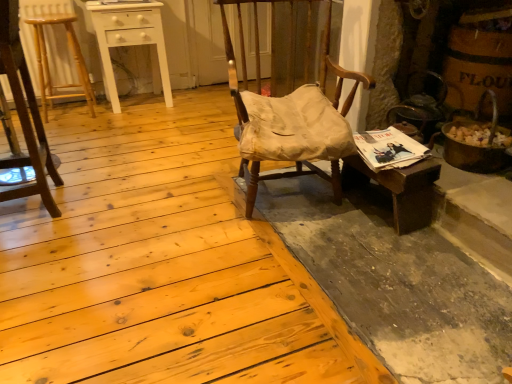
Question: Is wooden stool at left, which is the 2th chair in right-to-left order, shorter than matte paper magazine at right?

Choices:
 (A) yes
 (B) no

Answer: (B)

Question: From the image's perspective, is wooden stool at left, the first chair in the left-to-right sequence, on matte paper magazine at right?

Choices:
 (A) no
 (B) yes

Answer: (B)

Question: From the image's perspective, is wooden stool at left, the first chair in the left-to-right sequence, located beneath matte paper magazine at right?

Choices:
 (A) yes
 (B) no

Answer: (B)

Question: Is wooden stool at left, the first chair in the left-to-right sequence, closer to camera compared to matte paper magazine at right?

Choices:
 (A) no
 (B) yes

Answer: (B)

Question: Is wooden stool at left, the first chair in the left-to-right sequence, positioned with its back to matte paper magazine at right?

Choices:
 (A) no
 (B) yes

Answer: (A)

Question: Are wooden stool at left, the first chair in the left-to-right sequence, and matte paper magazine at right making contact?

Choices:
 (A) no
 (B) yes

Answer: (A)

Question: From a real-world perspective, does wooden desk at right sit lower than matte paper magazine at right?

Choices:
 (A) yes
 (B) no

Answer: (A)

Question: Does wooden desk at right have a smaller size compared to matte paper magazine at right?

Choices:
 (A) no
 (B) yes

Answer: (A)

Question: Is wooden desk at right wider than matte paper magazine at right?

Choices:
 (A) yes
 (B) no

Answer: (B)

Question: Is wooden desk at right to the left of matte paper magazine at right from the viewer's perspective?

Choices:
 (A) no
 (B) yes

Answer: (A)

Question: Can you confirm if wooden desk at right is taller than matte paper magazine at right?

Choices:
 (A) yes
 (B) no

Answer: (A)

Question: Is wooden desk at right positioned behind matte paper magazine at right?

Choices:
 (A) yes
 (B) no

Answer: (B)

Question: Is light brown wood bar stool at left at the right side of wooden stool at left, the first chair in the left-to-right sequence?

Choices:
 (A) no
 (B) yes

Answer: (A)